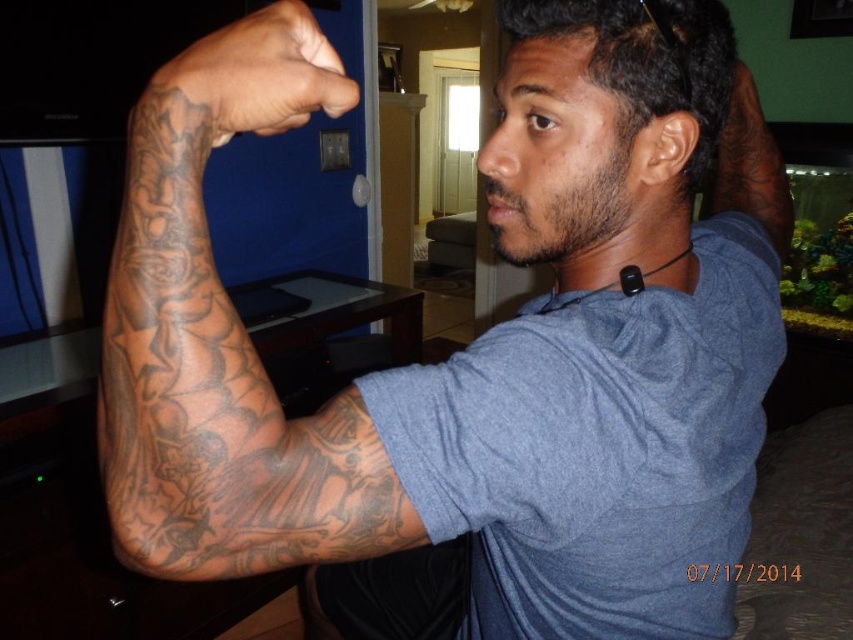
You are a photographer adjusting your camera settings to capture the man in the living room. The camera is set to focus on the point at coordinate point [316,419]. If the camera requires the subject to be at least 20 inches away to avoid blurring, will the photo be clear?

The point [316,419] is only 19.53 inches from the camera, which is less than the required 20 inches. Therefore, the photo may be blurry due to the subject being too close.

You are a photographer trying to capture the full view of both the black tattooed arm at left and the black tattooed arm at upper right in a single shot. Based on their positions, which arm should you focus on first to ensure both are visible in the frame?

The black tattooed arm at left is below the black tattooed arm at upper right, so you should focus on the black tattooed arm at upper right first to ensure both are visible in the frame.